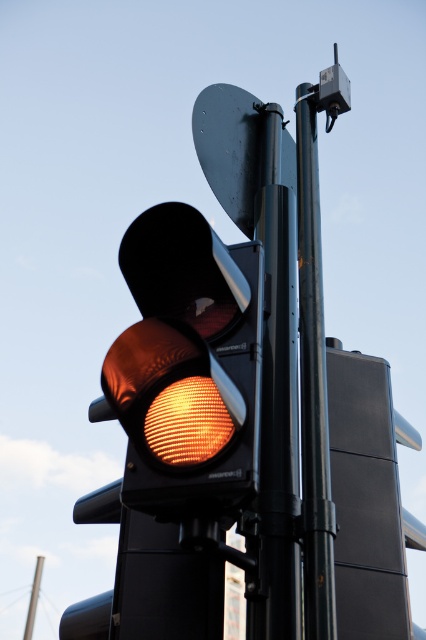
Describe the element at coordinates (187, 368) in the screenshot. The height and width of the screenshot is (640, 426). I see `matte orange glass traffic light at center` at that location.

What do you see at coordinates (187, 368) in the screenshot?
I see `matte orange glass traffic light at center` at bounding box center [187, 368].

You are a GUI agent. You are given a task and a screenshot of the screen. Output one action in this format:
    pyautogui.click(x=<x>, y=<y>)
    Task: Click on the matte orange glass traffic light at center
    This screenshot has width=426, height=640.
    Given the screenshot: What is the action you would take?
    pyautogui.click(x=187, y=368)

Is black matte pole at center wider than smooth black sign at upper center?

No.

This screenshot has height=640, width=426. Describe the element at coordinates (276, 397) in the screenshot. I see `black matte pole at center` at that location.

The width and height of the screenshot is (426, 640). What are the coordinates of `black matte pole at center` in the screenshot? It's located at (276, 397).

Is point (310, 614) in front of point (244, 172)?

Yes, it is in front of point (244, 172).

Can you confirm if black metallic pole at center is positioned below smooth black sign at upper center?

Correct, black metallic pole at center is located below smooth black sign at upper center.

Who is more distant from viewer, (296, 124) or (245, 189)?

The point (296, 124) is behind.

I want to click on black metallic pole at center, so click(x=313, y=384).